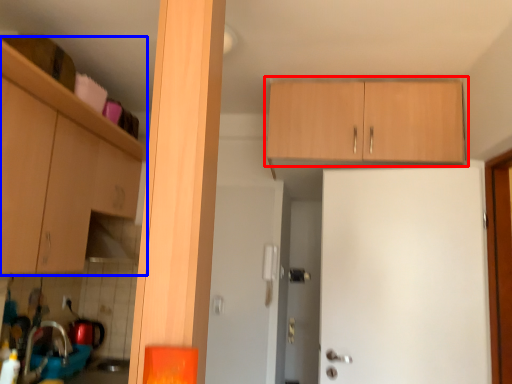
Question: Which of the following is the closest to the observer, cabinetry (highlighted by a red box) or cabinetry (highlighted by a blue box)?

Choices:
 (A) cabinetry
 (B) cabinetry

Answer: (B)